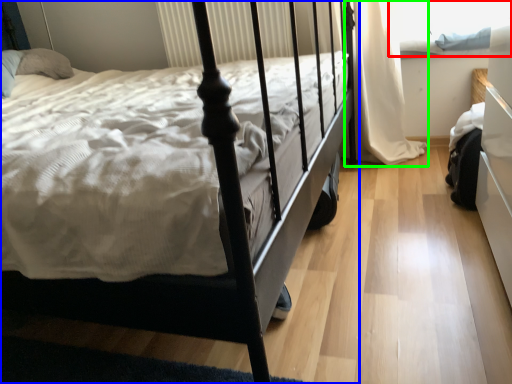
Question: Which object is the farthest from window screen (highlighted by a red box)? Choose among these: bed (highlighted by a blue box) or curtain (highlighted by a green box).

Choices:
 (A) bed
 (B) curtain

Answer: (A)